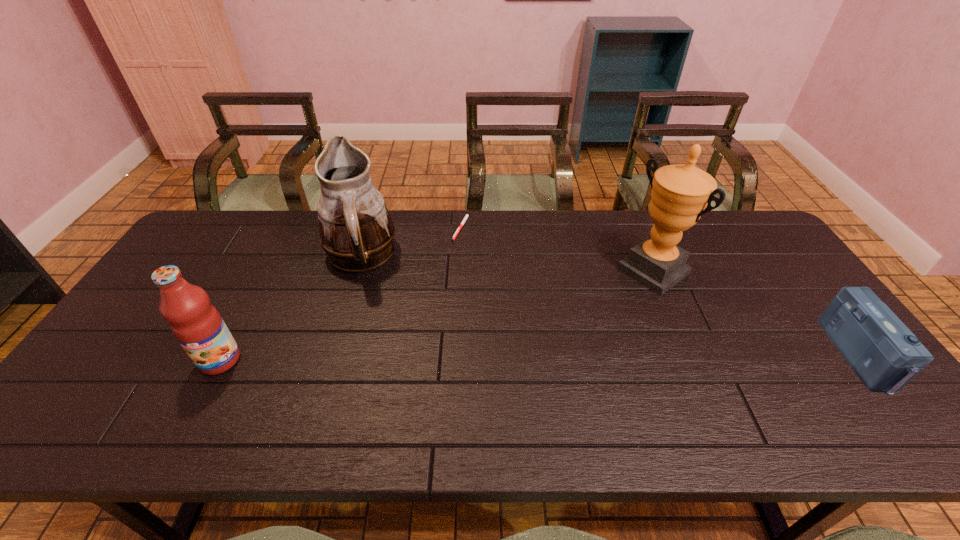
Locate an element on the screen. vacant area at the far right corner of the desktop is located at coordinates (727, 237).

In order to click on free space that is in between the award and the rightmost object in this screenshot , I will do `click(756, 313)`.

Locate an element on the screen. free space between the fourth tallest object and the leftmost object is located at coordinates (540, 358).

Locate an element on the screen. vacant space that's between the fruit juice and the award is located at coordinates (437, 315).

Locate an element on the screen. Image resolution: width=960 pixels, height=540 pixels. vacant area between the third object from right to left and the leftmost object is located at coordinates (341, 293).

Locate an element on the screen. free space between the fourth object from left to right and the fruit juice is located at coordinates (437, 315).

Where is `vacant point located between the shortest object and the award`? vacant point located between the shortest object and the award is located at coordinates (557, 249).

The height and width of the screenshot is (540, 960). I want to click on free space between the leftmost object and the pen, so click(341, 293).

At what (x,y) coordinates should I click in order to perform the action: click on vacant area that lies between the shortest object and the third shortest object. Please return your answer as a coordinate pair (x, y). This screenshot has height=540, width=960. Looking at the image, I should click on (341, 293).

Identify the location of blank region between the pen and the fruit juice. The height and width of the screenshot is (540, 960). (341, 293).